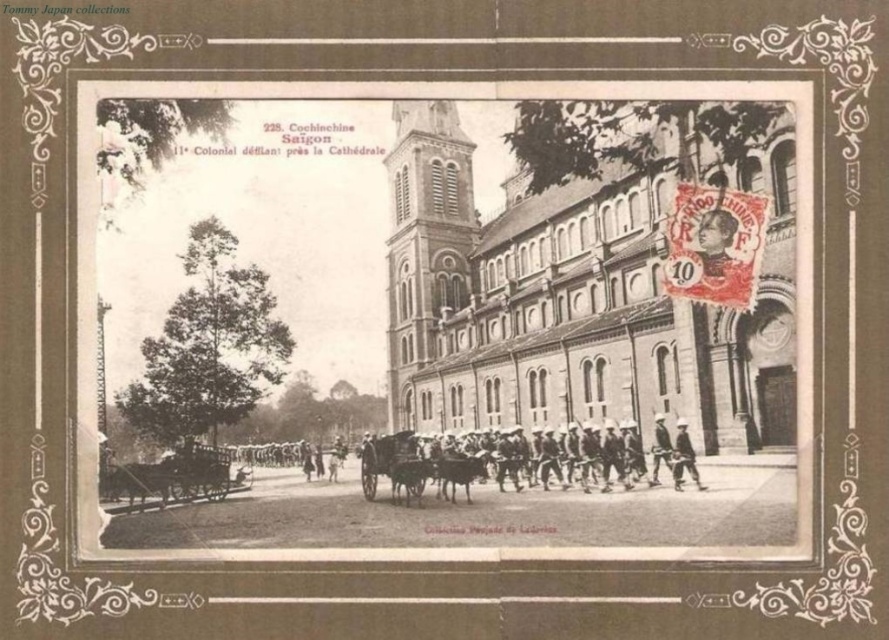
Can you confirm if smooth brown skin at upper right is positioned to the left of light brown leather hat at lower right?

No, smooth brown skin at upper right is not to the left of light brown leather hat at lower right.

Can you confirm if smooth brown skin at upper right is thinner than light brown leather hat at lower right?

Yes.

Is point (733, 218) positioned after point (686, 429)?

No.

Where is `smooth brown skin at upper right`? smooth brown skin at upper right is located at coordinates (715, 241).

Who is more distant from viewer, (679, 433) or (665, 452)?

Positioned behind is point (665, 452).

Does point (695, 472) lie in front of point (665, 444)?

That is True.

Identify the location of light brown leather hat at lower right. The image size is (889, 640). (683, 458).

Who is taller, stone church at center or smooth brown skin at upper right?

With more height is stone church at center.

Image resolution: width=889 pixels, height=640 pixels. Identify the location of stone church at center. (581, 292).

Find the location of a particular element. Image resolution: width=889 pixels, height=640 pixels. stone church at center is located at coordinates (581, 292).